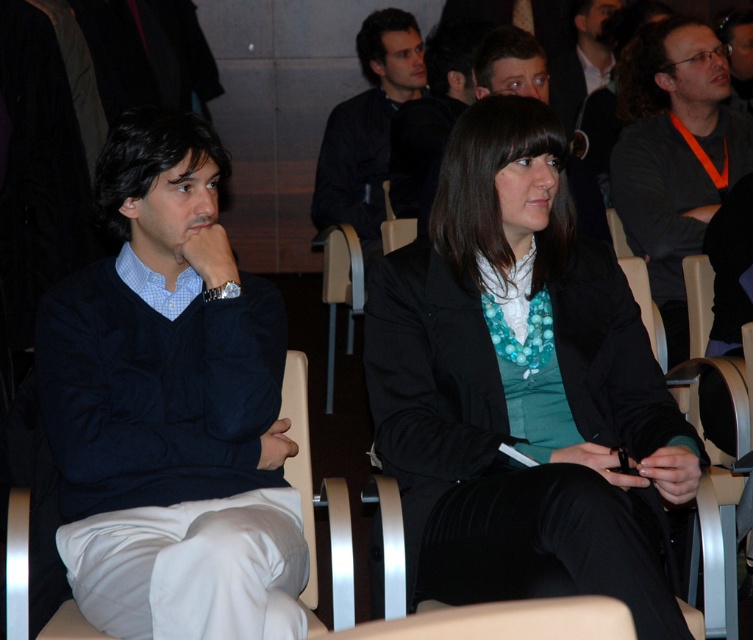
Is black matte shirt at center shorter than dark brown leather jacket at upper right?

In fact, black matte shirt at center may be taller than dark brown leather jacket at upper right.

Between point (386, 106) and point (569, 122), which one is positioned behind?

The point (569, 122) is behind.

At what (x,y) coordinates should I click in order to perform the action: click on black matte shirt at center. Please return your answer as a coordinate pair (x, y). The image size is (753, 640). Looking at the image, I should click on (367, 129).

From the picture: Does dark gray sweater at upper right have a greater width compared to black matte shirt at center?

Correct, the width of dark gray sweater at upper right exceeds that of black matte shirt at center.

Is dark gray sweater at upper right positioned at the back of black matte shirt at center?

No, it is not.

Does point (662, 124) lie in front of point (337, 129)?

Yes.

Find the location of a particular element. This screenshot has width=753, height=640. dark gray sweater at upper right is located at coordinates (672, 154).

Does white fabric chair at center appear over dark brown leather jacket at upper right?

No, white fabric chair at center is not above dark brown leather jacket at upper right.

Between white fabric chair at center and dark brown leather jacket at upper right, which one is positioned higher?

dark brown leather jacket at upper right

Identify the location of white fabric chair at center. The width and height of the screenshot is (753, 640). (319, 504).